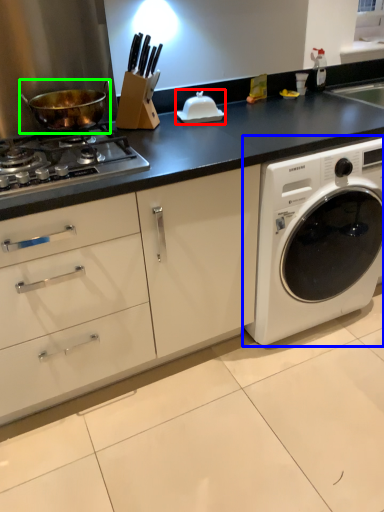
Question: Estimate the real-world distances between objects in this image. Which object is closer to appliance (highlighted by a red box), washing machine (highlighted by a blue box) or wok (highlighted by a green box)?

Choices:
 (A) washing machine
 (B) wok

Answer: (B)